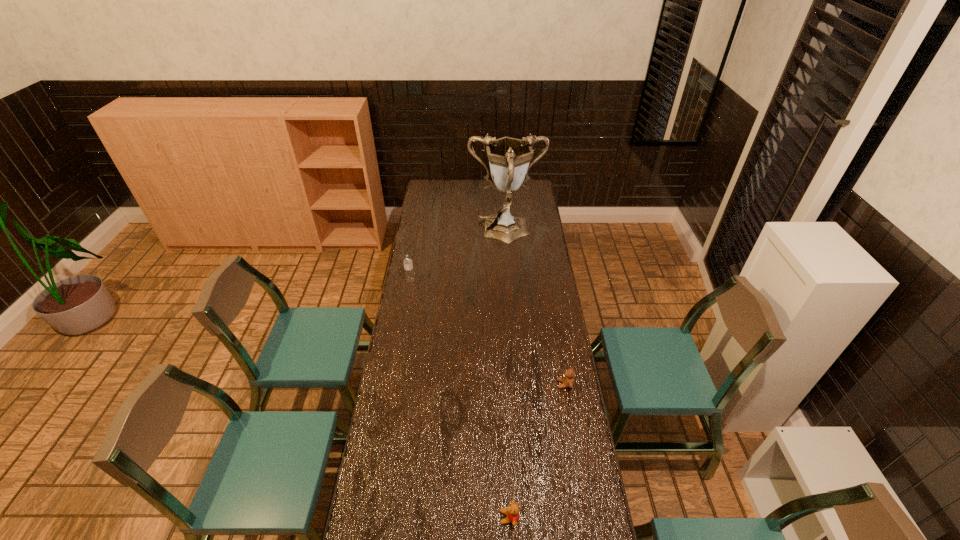
The width and height of the screenshot is (960, 540). I want to click on trophy cup, so click(510, 159).

The width and height of the screenshot is (960, 540). In order to click on the farthest object in this screenshot , I will do `click(510, 159)`.

Locate an element on the screen. The width and height of the screenshot is (960, 540). the second tallest object is located at coordinates (408, 265).

Find the location of a particular element. water bottle is located at coordinates (408, 265).

You are a GUI agent. You are given a task and a screenshot of the screen. Output one action in this format:
    pyautogui.click(x=<x>, y=<y>)
    Task: Click on the third farthest object
    This screenshot has height=540, width=960.
    Given the screenshot: What is the action you would take?
    pyautogui.click(x=568, y=381)

I want to click on the right teddy bear, so click(x=568, y=381).

The image size is (960, 540). I want to click on the nearer teddy bear, so click(512, 511).

Find the location of a particular element. This screenshot has height=540, width=960. the nearest object is located at coordinates (512, 511).

The height and width of the screenshot is (540, 960). I want to click on vacant region located on the back of the tallest object, so click(x=503, y=191).

This screenshot has height=540, width=960. Identify the location of free space located 0.280m on the back of the second farthest object. (417, 244).